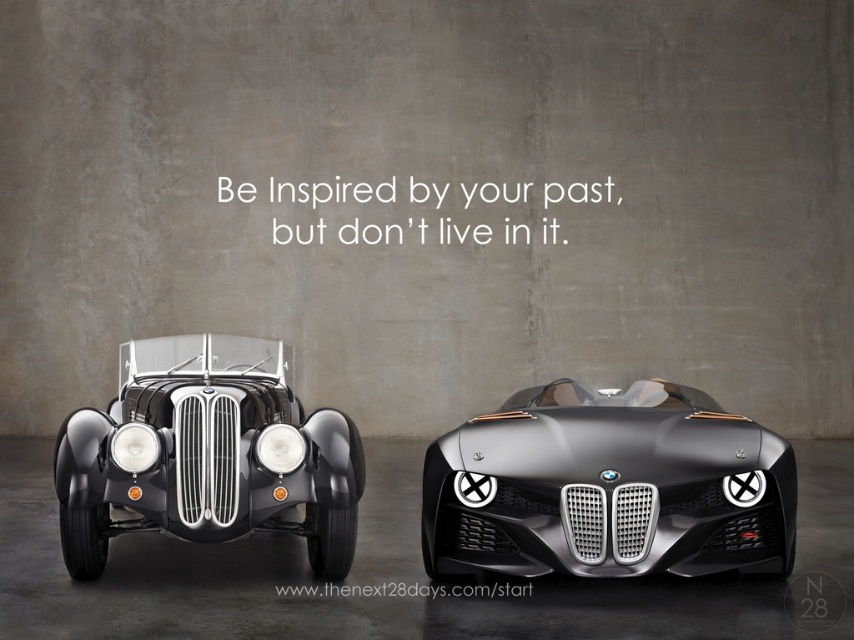
Is shiny metallic sports car at center wider than matte white headlight at left?

Correct, the width of shiny metallic sports car at center exceeds that of matte white headlight at left.

Is shiny metallic sports car at center to the left of matte white headlight at left from the viewer's perspective?

Incorrect, shiny metallic sports car at center is not on the left side of matte white headlight at left.

Does point (746, 436) lie behind point (123, 449)?

That is True.

Identify the location of shiny metallic sports car at center. This screenshot has width=854, height=640. (607, 486).

This screenshot has height=640, width=854. Describe the element at coordinates (208, 452) in the screenshot. I see `glossy black car at left` at that location.

Is point (272, 369) in front of point (301, 445)?

That is False.

Locate an element on the screen. The height and width of the screenshot is (640, 854). glossy black car at left is located at coordinates (208, 452).

Between shiny metallic sports car at center and glossy black car at left, which one appears on the left side from the viewer's perspective?

glossy black car at left is more to the left.

Based on the photo, does shiny metallic sports car at center appear on the right side of glossy black car at left?

Indeed, shiny metallic sports car at center is positioned on the right side of glossy black car at left.

Who is more distant from viewer, (752,525) or (150,365)?

Point (150,365)

The image size is (854, 640). I want to click on shiny metallic sports car at center, so click(607, 486).